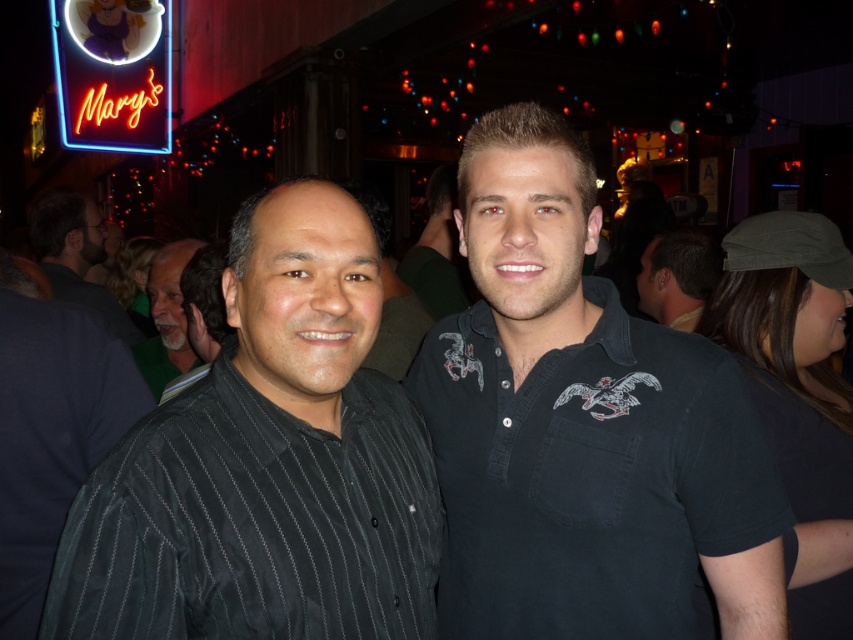
Does neon sign at upper left come in front of black matte shirt at center?

No, neon sign at upper left is further to the viewer.

Looking at this image, does neon sign at upper left appear over black matte shirt at center?

Indeed, neon sign at upper left is positioned over black matte shirt at center.

At what (x,y) coordinates should I click in order to perform the action: click on neon sign at upper left. Please return your answer as a coordinate pair (x, y). Looking at the image, I should click on (113, 74).

Can you confirm if matte black shirt at center is bigger than black matte shirt at center?

No, matte black shirt at center is not bigger than black matte shirt at center.

Does matte black shirt at center have a greater width compared to black matte shirt at center?

No.

Does point (695, 264) come behind point (433, 252)?

No, it is in front of (433, 252).

At what (x,y) coordinates should I click in order to perform the action: click on matte black shirt at center. Please return your answer as a coordinate pair (x, y). This screenshot has height=640, width=853. Looking at the image, I should click on (677, 276).

Is point (589, 548) closer to viewer compared to point (404, 273)?

Yes.

Can you confirm if black cotton polo shirt at right is positioned to the right of black matte shirt at center?

Indeed, black cotton polo shirt at right is positioned on the right side of black matte shirt at center.

Does point (688, 355) lie behind point (437, 168)?

No, (688, 355) is closer to viewer.

You are a GUI agent. You are given a task and a screenshot of the screen. Output one action in this format:
    pyautogui.click(x=<x>, y=<y>)
    Task: Click on the black cotton polo shirt at right
    Image resolution: width=853 pixels, height=640 pixels.
    Given the screenshot: What is the action you would take?
    pos(582,428)